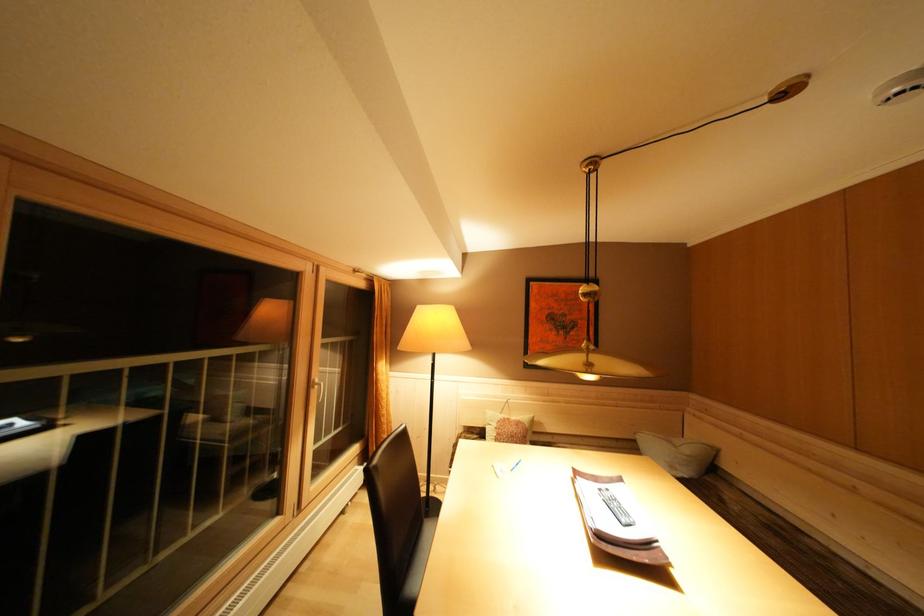
Where is `sofa sitting surface`? Image resolution: width=924 pixels, height=616 pixels. sofa sitting surface is located at coordinates (749, 515).